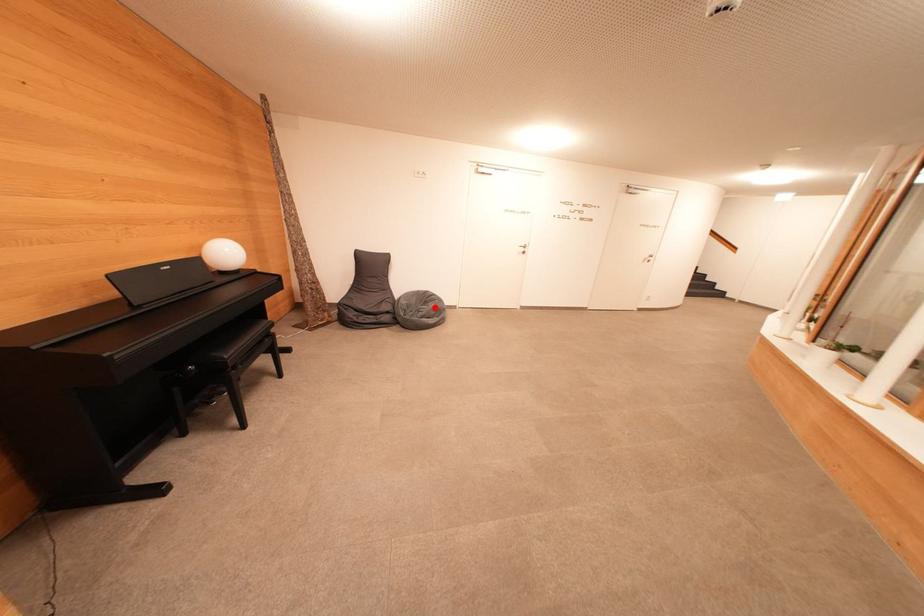
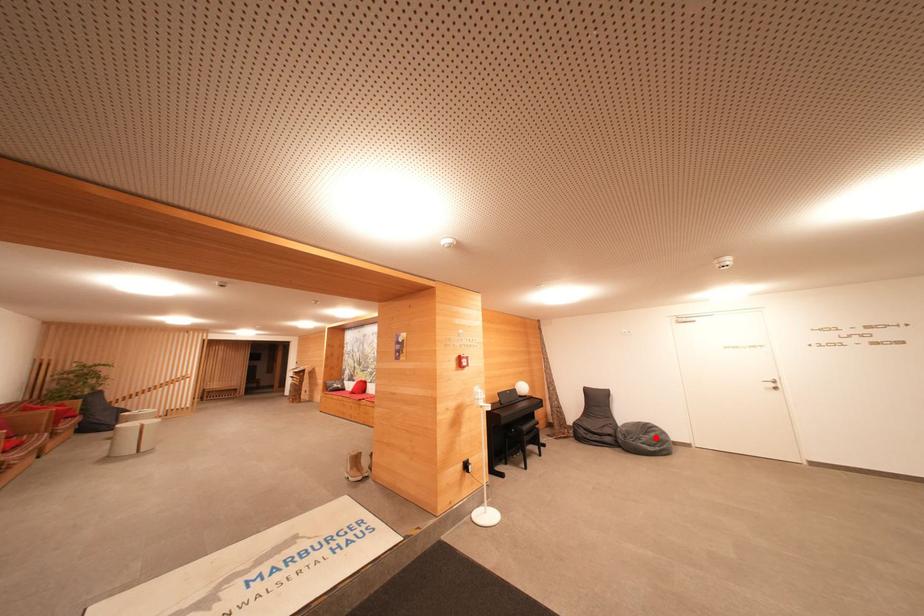
I am providing you with two images of the same scene from different viewpoints. A red point is marked on the first image and another point is marked on the second image. Is the marked point in image1 the same physical position as the marked point in image2?

Yes